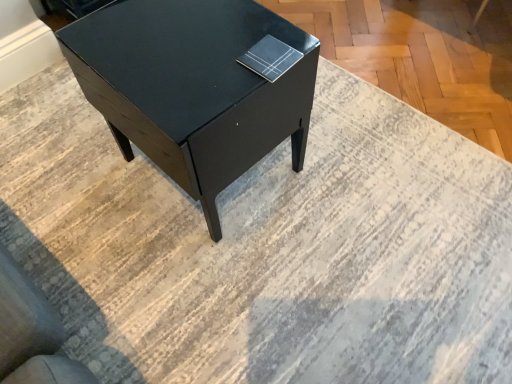
Where is `vacant region to the left of matte black book at upper right`? This screenshot has width=512, height=384. vacant region to the left of matte black book at upper right is located at coordinates (205, 66).